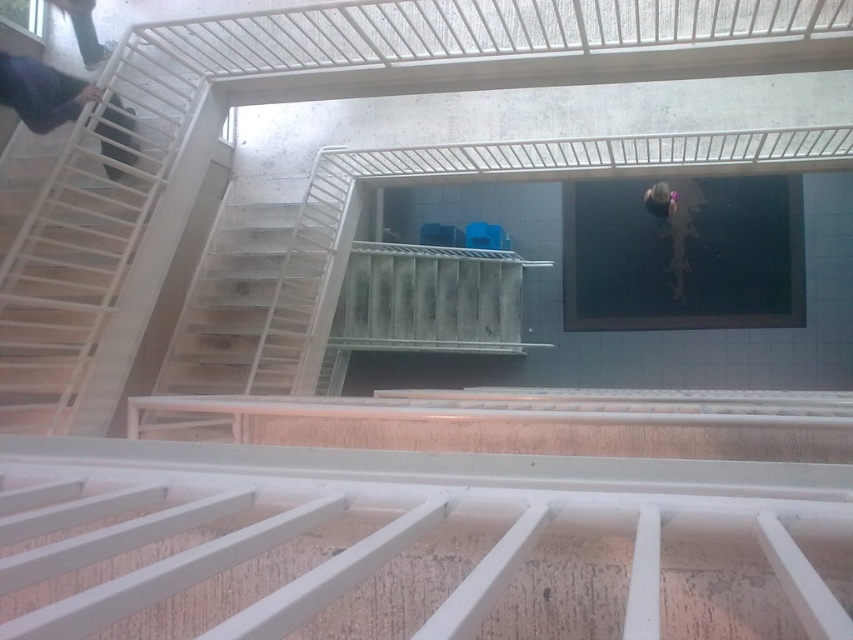
You are an inspector checking the safety of the stairwell. You notice the dark blue fabric at upper left and the smooth purple helmet at upper center. Which object is taller?

The dark blue fabric at upper left has a greater height compared to the smooth purple helmet at upper center, so the dark blue fabric at upper left is taller.

Looking at this image, you are an inspector checking the safety of the stairwell. You notice the dark blue fabric at upper left and the smooth purple helmet at upper center. Which object is located lower in the image?

The dark blue fabric at upper left is positioned under the smooth purple helmet at upper center, so it is located lower in the image.

You are a delivery person carrying a package and need to navigate through the stairwell. You see the dark blue fabric at upper left and the smooth purple helmet at upper center. Which object is positioned closer to you as you face the stairwell?

The dark blue fabric at upper left is closer to the viewer than the smooth purple helmet at upper center.